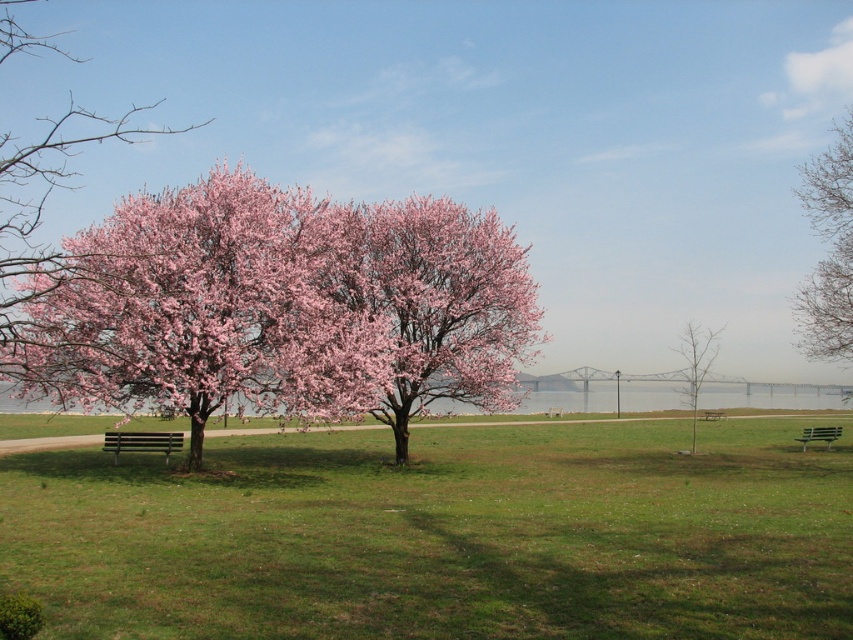
You are standing at the point marked by coordinates point (39, 218) in the image. Looking around, you see a pink bloom tree at left. Which direction should you face to look towards the pink bloom tree at left?

You should face towards the left to look towards the pink bloom tree at left, as the point (39, 218) indicates its location at the left side of the image.

Based on the photo, you are planning to place a new statue that is 2 meters tall in the garden. The statue needs to be placed where it won not block the view of the pink bloom tree at left from the wooden bench at lower left. Based on the scene, can you determine if placing the statue between them would be a problem?

The pink bloom tree at left is much taller than the wooden bench at lower left. Since the statue is 2 meters tall, which is shorter than the tree, placing it between them might not block the view as the tree is taller and the statue is shorter. However, the exact placement would depend on the distance and angle from the bench to the tree.